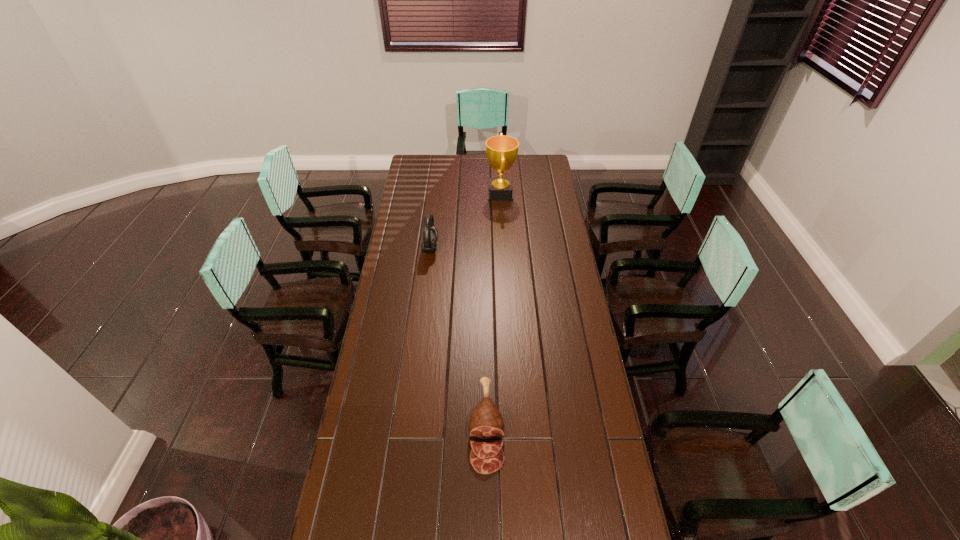
Where is `the tallest object`? The width and height of the screenshot is (960, 540). the tallest object is located at coordinates (501, 150).

At what (x,y) coordinates should I click in order to perform the action: click on award. Please return your answer as a coordinate pair (x, y). The image size is (960, 540). Looking at the image, I should click on (501, 150).

At what (x,y) coordinates should I click in order to perform the action: click on the leftmost object. Please return your answer as a coordinate pair (x, y). Image resolution: width=960 pixels, height=540 pixels. Looking at the image, I should click on (430, 234).

At what (x,y) coordinates should I click in order to perform the action: click on the second shortest object. Please return your answer as a coordinate pair (x, y). Image resolution: width=960 pixels, height=540 pixels. Looking at the image, I should click on (430, 234).

The height and width of the screenshot is (540, 960). I want to click on the nearest object, so click(x=486, y=424).

You are a GUI agent. You are given a task and a screenshot of the screen. Output one action in this format:
    pyautogui.click(x=<x>, y=<y>)
    Task: Click on the shortest object
    
    Given the screenshot: What is the action you would take?
    pyautogui.click(x=486, y=424)

The image size is (960, 540). Identify the location of free location located 0.240m on the front-facing side of the farthest object. (444, 194).

I want to click on vacant area situated 0.080m on the front-facing side of the farthest object, so click(x=471, y=194).

Where is `vacant space located on the front-facing side of the farthest object`? This screenshot has width=960, height=540. vacant space located on the front-facing side of the farthest object is located at coordinates (461, 194).

Where is `vacant space located on the earcups of the headset`? This screenshot has height=540, width=960. vacant space located on the earcups of the headset is located at coordinates (509, 248).